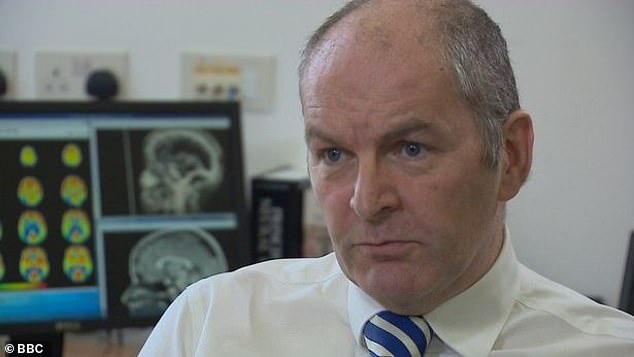
Locate an element on the screen. The width and height of the screenshot is (634, 357). computer monitor screen is located at coordinates (56, 265).